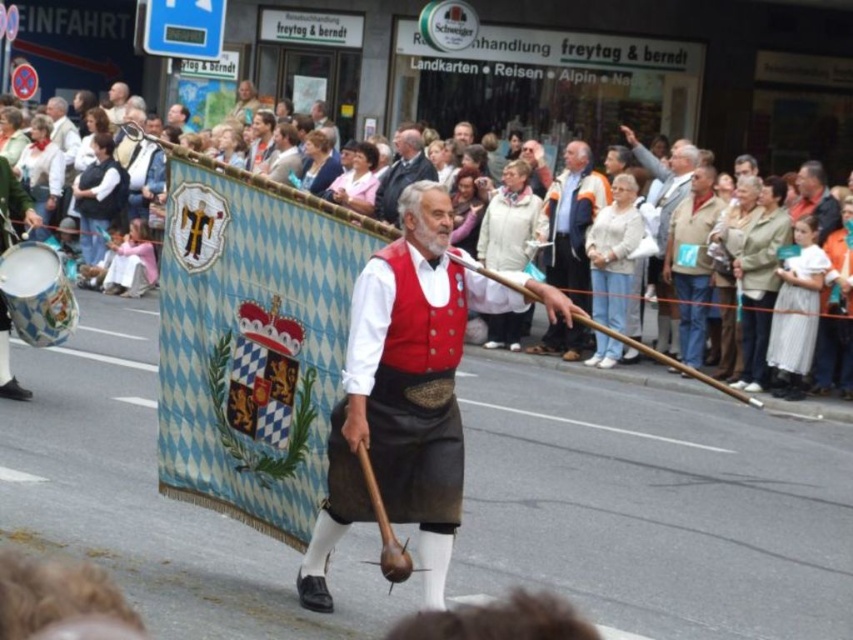
Is light beige fabric crowd at upper center below red velvet vest at center?

Yes.

Does light beige fabric crowd at upper center have a lesser width compared to red velvet vest at center?

No.

Which is behind, point (48, 113) or point (408, 157)?

The point (48, 113) is more distant.

Where is `light beige fabric crowd at upper center`? light beige fabric crowd at upper center is located at coordinates (48, 138).

Which is more to the right, light beige fabric crowd at upper center or red jacket at center?

red jacket at center

Who is more distant from viewer, (622, 186) or (577, 195)?

Positioned behind is point (577, 195).

Where is `light beige fabric crowd at upper center`? The image size is (853, 640). light beige fabric crowd at upper center is located at coordinates click(48, 138).

Between point (585, 221) and point (376, 212), which one is positioned in front?

Point (585, 221)

Find the location of a particular element. red jacket at center is located at coordinates (572, 221).